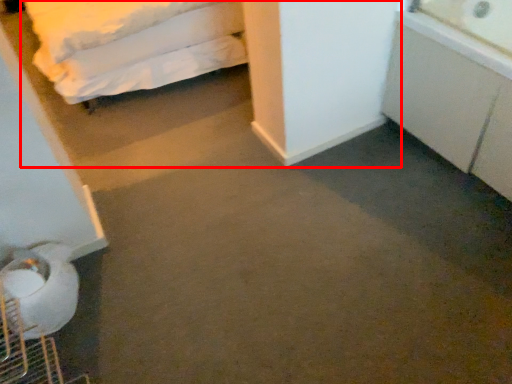
Question: From the image's perspective, what is the correct spatial positioning of bed (annotated by the red box) in reference to cabinetry?

Choices:
 (A) below
 (B) above

Answer: (B)